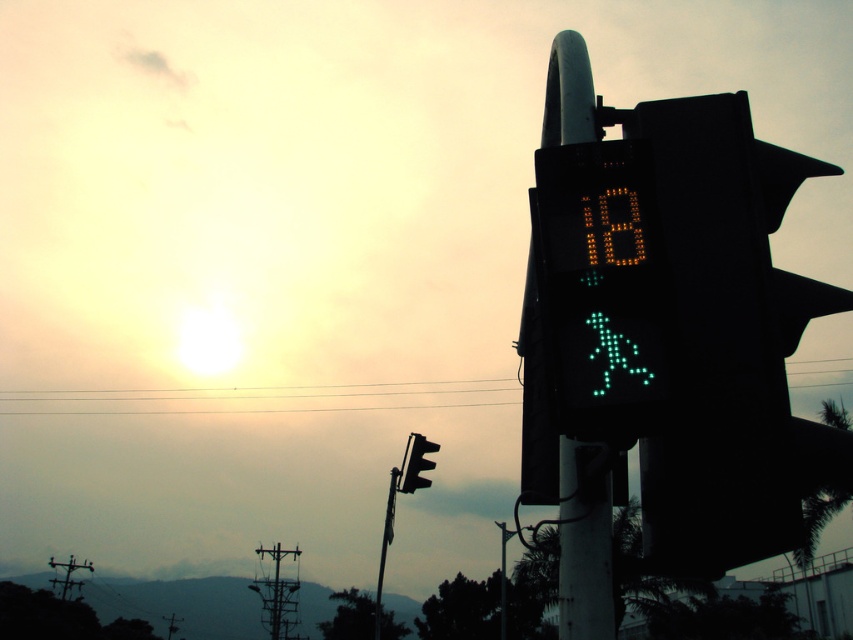
Is black matte pole at center further to the viewer compared to green wire at upper center?

No, black matte pole at center is closer to the viewer.

Is point (560, 586) farther from viewer compared to point (115, 410)?

That is False.

Who is more forward, (561, 36) or (408, 401)?

Positioned in front is point (561, 36).

Identify the location of black matte pole at center. (585, 572).

Is black plastic pedestrian signal at right below green wire at upper center?

No, black plastic pedestrian signal at right is not below green wire at upper center.

The width and height of the screenshot is (853, 640). Identify the location of black plastic pedestrian signal at right. coord(730,346).

Consider the image. Who is more forward, (734, 476) or (33, 413)?

Point (734, 476) is more forward.

Identify the location of black plastic pedestrian signal at right. The width and height of the screenshot is (853, 640). (730, 346).

Does black matte pole at center appear on the left side of black plastic traffic light at center?

Incorrect, black matte pole at center is not on the left side of black plastic traffic light at center.

The width and height of the screenshot is (853, 640). What do you see at coordinates (585, 572) in the screenshot? I see `black matte pole at center` at bounding box center [585, 572].

Find the location of `black matte pole at center`. black matte pole at center is located at coordinates (585, 572).